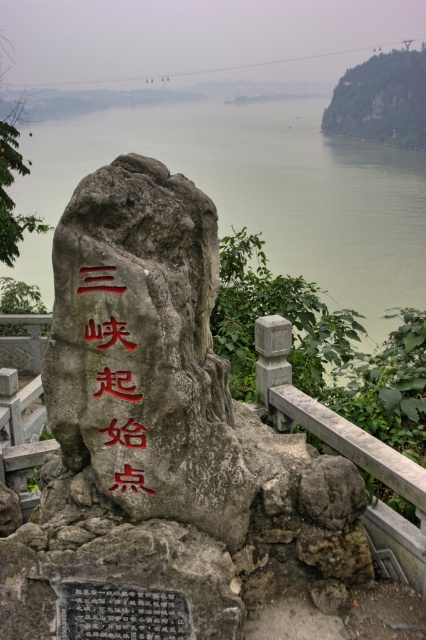
Is black stone plaque at center shorter than red carved stone at center?

Yes.

Is point (132, 589) farther from viewer compared to point (132, 346)?

Yes, point (132, 589) is behind point (132, 346).

Where is `black stone plaque at center`? The height and width of the screenshot is (640, 426). black stone plaque at center is located at coordinates (120, 612).

Locate an element on the screen. Image resolution: width=426 pixels, height=640 pixels. black stone plaque at center is located at coordinates (120, 612).

Is green water at center positioned in front of red carved stone at center?

No, green water at center is further to the viewer.

Does green water at center appear over red carved stone at center?

Yes.

Which is behind, point (255, 218) or point (88, 333)?

The point (255, 218) is more distant.

Locate an element on the screen. This screenshot has width=426, height=640. green water at center is located at coordinates (265, 189).

You are a GUI agent. You are given a task and a screenshot of the screen. Output one action in this format:
    pyautogui.click(x=<x>, y=<y>)
    Task: Click on the rough gray rock at center
    The height and width of the screenshot is (640, 426).
    Given the screenshot: What is the action you would take?
    [x=143, y=349]

Can you confirm if rough gray rock at center is shorter than red carved stone at center?

No, rough gray rock at center is not shorter than red carved stone at center.

What do you see at coordinates (143, 349) in the screenshot? The image size is (426, 640). I see `rough gray rock at center` at bounding box center [143, 349].

Where is `rough gray rock at center`? This screenshot has width=426, height=640. rough gray rock at center is located at coordinates (143, 349).